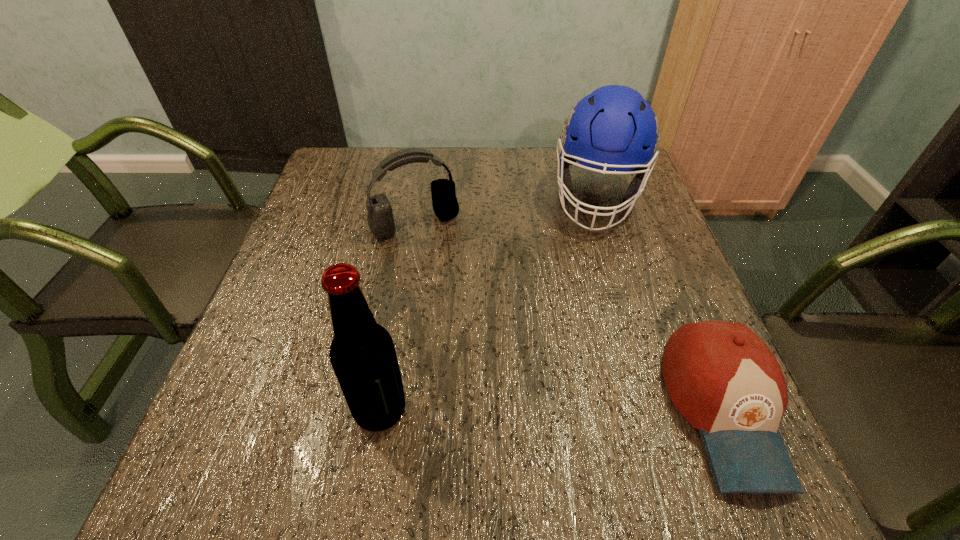
You are a GUI agent. You are given a task and a screenshot of the screen. Output one action in this format:
    pyautogui.click(x=<x>, y=<y>)
    Task: Click on the free space on the desktop that is between the beer bottle and the shortest object and is positioned on the headband of the headset
    Image resolution: width=960 pixels, height=540 pixels.
    Given the screenshot: What is the action you would take?
    (x=518, y=410)

Identify the location of vacant space on the desktop that is between the beer bottle and the shortest object and is positioned on the face guard of the second tallest object. (567, 410).